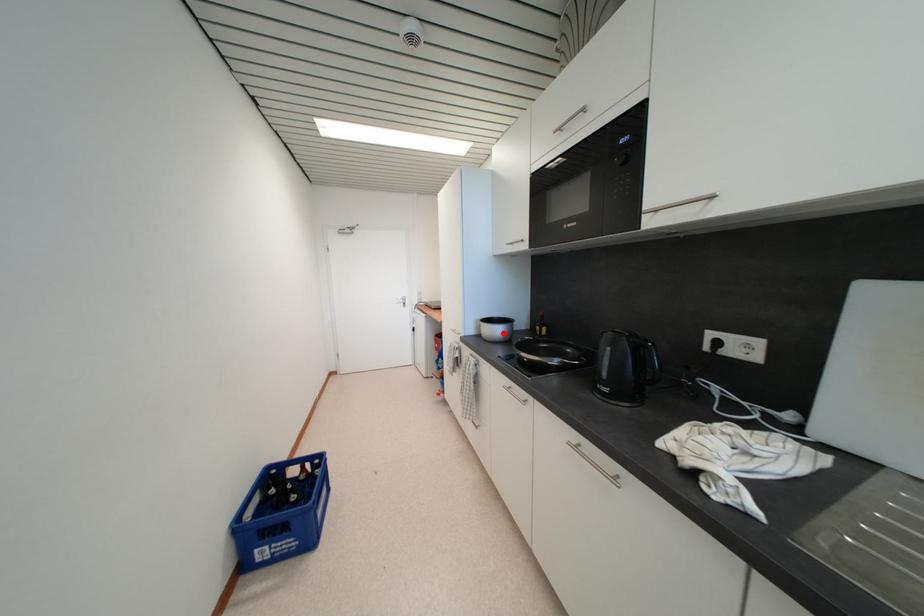
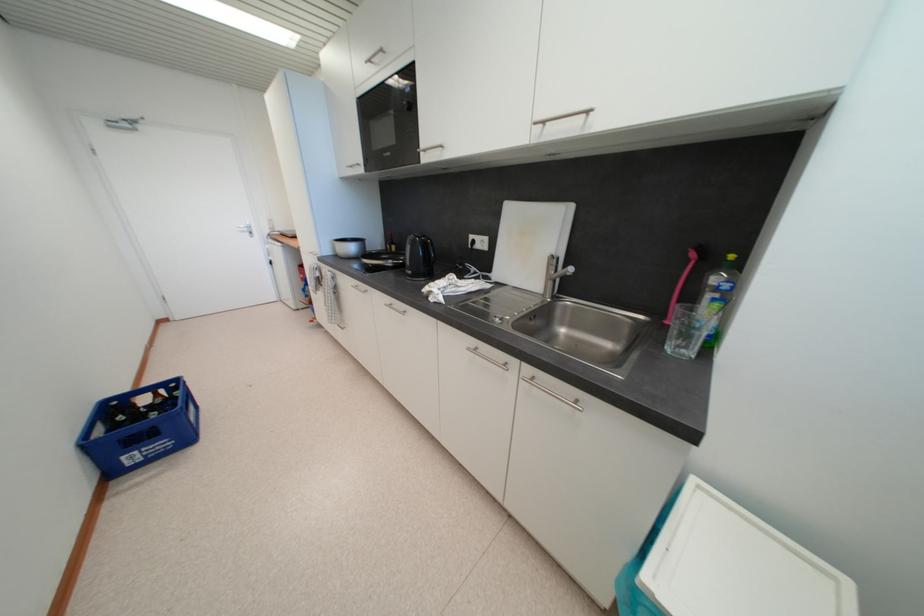
Question: I am providing you with two images of the same scene from different viewpoints. A red point is marked on the first image. Is the red point's position out of view in image 2?

Choices:
 (A) Yes
 (B) No

Answer: (B)